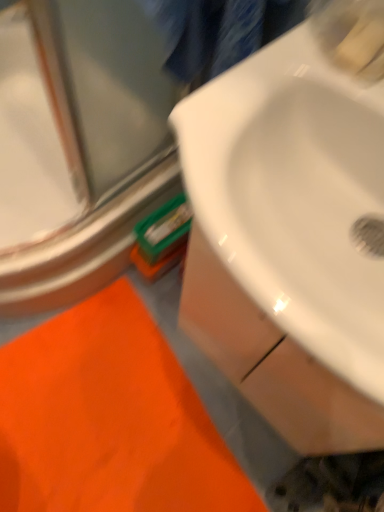
Question: From the image's perspective, is orange fabric bath mat at lower left above white glossy sink at center?

Choices:
 (A) yes
 (B) no

Answer: (B)

Question: Can you confirm if orange fabric bath mat at lower left is bigger than white glossy sink at center?

Choices:
 (A) no
 (B) yes

Answer: (A)

Question: Is orange fabric bath mat at lower left further to the viewer compared to white glossy sink at center?

Choices:
 (A) yes
 (B) no

Answer: (A)

Question: Are orange fabric bath mat at lower left and white glossy sink at center located far from each other?

Choices:
 (A) no
 (B) yes

Answer: (A)

Question: From a real-world perspective, is orange fabric bath mat at lower left located higher than white glossy sink at center?

Choices:
 (A) yes
 (B) no

Answer: (B)

Question: Considering the relative positions of orange fabric bath mat at lower left and white glossy sink at center in the image provided, is orange fabric bath mat at lower left to the right of white glossy sink at center from the viewer's perspective?

Choices:
 (A) yes
 (B) no

Answer: (B)

Question: Is white glossy sink at center facing away from orange fabric bath mat at lower left?

Choices:
 (A) yes
 (B) no

Answer: (B)

Question: Is white glossy sink at center smaller than orange fabric bath mat at lower left?

Choices:
 (A) yes
 (B) no

Answer: (B)

Question: Is white glossy sink at center positioned far away from orange fabric bath mat at lower left?

Choices:
 (A) yes
 (B) no

Answer: (B)

Question: Can you confirm if white glossy sink at center is positioned to the right of orange fabric bath mat at lower left?

Choices:
 (A) no
 (B) yes

Answer: (B)

Question: Can you confirm if white glossy sink at center is shorter than orange fabric bath mat at lower left?

Choices:
 (A) no
 (B) yes

Answer: (A)

Question: From the image's perspective, is white glossy sink at center on orange fabric bath mat at lower left?

Choices:
 (A) yes
 (B) no

Answer: (A)

Question: From the image's perspective, is orange fabric bath mat at lower left on clear glass door at upper left?

Choices:
 (A) no
 (B) yes

Answer: (A)